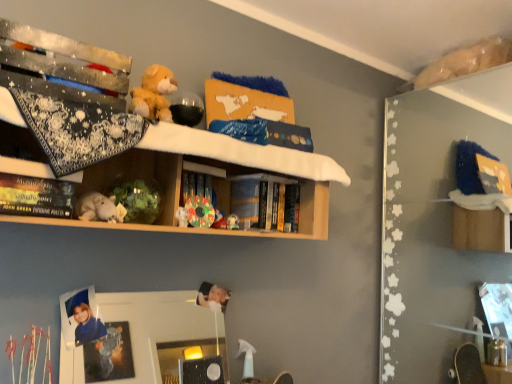
Where is `multicolored plastic toy at center, the third toy when ordered from front to back`? This screenshot has height=384, width=512. multicolored plastic toy at center, the third toy when ordered from front to back is located at coordinates (200, 211).

Locate an element on the screen. clear glass mirror at center is located at coordinates (141, 338).

Image resolution: width=512 pixels, height=384 pixels. Describe the element at coordinates (100, 208) in the screenshot. I see `white plush toy at center, the 1th toy viewed from the left` at that location.

Measure the distance between translucent plastic toy at center, the second toy in the right-to-left sequence, and camera.

A distance of 4.41 feet exists between translucent plastic toy at center, the second toy in the right-to-left sequence, and camera.

Image resolution: width=512 pixels, height=384 pixels. Find the location of `multicolored plastic toy at center, the first toy positioned from the back`. multicolored plastic toy at center, the first toy positioned from the back is located at coordinates (200, 211).

Are clear glass mirror at center and translucent plastic toy at center, acting as the second toy starting from the back, located far from each other?

A: That's not correct — clear glass mirror at center is a little close to translucent plastic toy at center, acting as the second toy starting from the back.

Considering the positions of point (147, 360) and point (186, 209), is point (147, 360) closer or farther from the camera than point (186, 209)?

Point (147, 360) appears to be farther away from the viewer than point (186, 209).

From a real-world perspective, who is located higher, clear glass mirror at center or translucent plastic toy at center, the second toy in the right-to-left sequence?

In real-world perspective, translucent plastic toy at center, the second toy in the right-to-left sequence, is above.

Is translucent plastic toy at center, the 2th toy when ordered from front to back, inside the boundaries of white plush toy at center, the first toy from the front, or outside?

translucent plastic toy at center, the 2th toy when ordered from front to back, is not enclosed by white plush toy at center, the first toy from the front.

Considering the sizes of objects translucent plastic toy at center, acting as the second toy starting from the back, and white plush toy at center, which is the third toy from back to front, in the image provided, who is bigger, translucent plastic toy at center, acting as the second toy starting from the back, or white plush toy at center, which is the third toy from back to front,?

white plush toy at center, which is the third toy from back to front.

Can you confirm if translucent plastic toy at center, which is the 2th toy from left to right, is wider than white plush toy at center, the third toy from the right?

No, translucent plastic toy at center, which is the 2th toy from left to right, is not wider than white plush toy at center, the third toy from the right.

From the image's perspective, is translucent plastic toy at center, the second toy in the right-to-left sequence, located beneath white plush toy at center, which is the third toy from back to front?

Yes.

Does hardcover book at upper left, which ranks as the 1th book in front-to-back order, have a smaller size compared to wooden shelf at upper center?

Answer: Yes, hardcover book at upper left, which ranks as the 1th book in front-to-back order, is smaller than wooden shelf at upper center.

Which is correct: hardcover book at upper left, which ranks as the 1th book in front-to-back order, is inside wooden shelf at upper center, or outside of it?

hardcover book at upper left, which ranks as the 1th book in front-to-back order, can be found inside wooden shelf at upper center.

Is hardcover book at upper left, which ranks as the 1th book in front-to-back order, wider than wooden shelf at upper center?

In fact, hardcover book at upper left, which ranks as the 1th book in front-to-back order, might be narrower than wooden shelf at upper center.

From a real-world perspective, is hardcover book at center, acting as the 1th book starting from the back, on top of multicolored plastic toy at center, the third toy in the left-to-right sequence?

Yes.

Does hardcover book at center, which ranks as the second book in front-to-back order, have a lesser height compared to multicolored plastic toy at center, the third toy in the left-to-right sequence?

No, hardcover book at center, which ranks as the second book in front-to-back order, is not shorter than multicolored plastic toy at center, the third toy in the left-to-right sequence.

Is hardcover book at center, the second book viewed from the left, facing towards multicolored plastic toy at center, the first toy positioned from the back?

No, hardcover book at center, the second book viewed from the left, is not facing towards multicolored plastic toy at center, the first toy positioned from the back.

Looking at the image, does hardcover book at center, the second book viewed from the left, seem bigger or smaller compared to multicolored plastic toy at center, the first toy positioned from the back?

Clearly, hardcover book at center, the second book viewed from the left, is larger in size than multicolored plastic toy at center, the first toy positioned from the back.

Considering the positions of objects translucent plastic toy at center, which is the 2th toy from left to right, and multicolored plastic toy at center, the 1th toy when ordered from right to left, in the image provided, who is more to the right, translucent plastic toy at center, which is the 2th toy from left to right, or multicolored plastic toy at center, the 1th toy when ordered from right to left,?

multicolored plastic toy at center, the 1th toy when ordered from right to left.

Is translucent plastic toy at center, acting as the second toy starting from the back, surrounding multicolored plastic toy at center, the third toy when ordered from front to back?

Actually, multicolored plastic toy at center, the third toy when ordered from front to back, is outside translucent plastic toy at center, acting as the second toy starting from the back.

Is translucent plastic toy at center, acting as the second toy starting from the back, aimed at multicolored plastic toy at center, the third toy when ordered from front to back?

No, translucent plastic toy at center, acting as the second toy starting from the back, is not aimed at multicolored plastic toy at center, the third toy when ordered from front to back.

Is translucent plastic toy at center, the second toy in the right-to-left sequence, bigger or smaller than multicolored plastic toy at center, the third toy when ordered from front to back?

In the image, translucent plastic toy at center, the second toy in the right-to-left sequence, appears to be smaller than multicolored plastic toy at center, the third toy when ordered from front to back.

Find the location of a particular element. The height and width of the screenshot is (384, 512). book to the left of clear glass mirror at center is located at coordinates (36, 196).

Which is more to the right, clear glass mirror at center or hardcover book at upper left, which ranks as the 1th book in front-to-back order?

clear glass mirror at center.

Are hardcover book at center, placed as the 1th book when sorted from right to left, and hardcover book at upper left, the 1th book positioned from the left, making contact?

No, hardcover book at center, placed as the 1th book when sorted from right to left, is not next to hardcover book at upper left, the 1th book positioned from the left.

Between hardcover book at center, the second book viewed from the left, and hardcover book at upper left, which ranks as the 1th book in front-to-back order, which one has larger width?

Wider between the two is hardcover book at upper left, which ranks as the 1th book in front-to-back order.

Would you say hardcover book at center, acting as the 1th book starting from the back, is inside or outside hardcover book at upper left, arranged as the second book when viewed from the right?

hardcover book at center, acting as the 1th book starting from the back, is outside hardcover book at upper left, arranged as the second book when viewed from the right.

From a real-world perspective, starting from the clear glass mirror at center, which toy is the 1st one vertically above it? Please provide its 2D coordinates.

[(182, 217)]

Find the location of a particular element. toy that is on the left side of translucent plastic toy at center, the 2th toy when ordered from front to back is located at coordinates (100, 208).

Based on their spatial positions, is hardcover book at upper left, which ranks as the 1th book in front-to-back order, or white plush toy at center, the third toy from the right, closer to multicolored plastic toy at center, the third toy in the left-to-right sequence?

white plush toy at center, the third toy from the right, is positioned closer to the anchor multicolored plastic toy at center, the third toy in the left-to-right sequence.

Which object lies nearer to the anchor point multicolored plastic toy at center, the third toy when ordered from front to back, translucent plastic toy at center, acting as the second toy starting from the back, or clear glass mirror at center?

The object closer to multicolored plastic toy at center, the third toy when ordered from front to back, is translucent plastic toy at center, acting as the second toy starting from the back.

Looking at the image, which one is located further to translucent plastic toy at center, which is the 2th toy from left to right, multicolored plastic toy at center, the third toy in the left-to-right sequence, or hardcover book at center, placed as the 1th book when sorted from right to left?

Based on the image, hardcover book at center, placed as the 1th book when sorted from right to left, appears to be further to translucent plastic toy at center, which is the 2th toy from left to right.

When comparing their distances from clear glass mirror at center, does translucent plastic toy at center, the second toy in the right-to-left sequence, or hardcover book at upper left, which ranks as the 1th book in front-to-back order, seem closer?

Based on the image, translucent plastic toy at center, the second toy in the right-to-left sequence, appears to be nearer to clear glass mirror at center.

Estimate the real-world distances between objects in this image. Which object is further from wooden shelf at upper center, translucent plastic toy at center, acting as the second toy starting from the back, or clear glass mirror at center?

Among the two, clear glass mirror at center is located further to wooden shelf at upper center.

From the picture: Looking at the image, which one is located further to translucent plastic toy at center, acting as the second toy starting from the back, white plush toy at center, the third toy from the right, or hardcover book at center, which ranks as the second book in front-to-back order?

hardcover book at center, which ranks as the second book in front-to-back order, lies further to translucent plastic toy at center, acting as the second toy starting from the back, than the other object.

From the image, which object appears to be farther from multicolored plastic toy at center, the 1th toy when ordered from right to left, hardcover book at upper left, arranged as the second book when viewed from the right, or clear glass mirror at center?

Among the two, clear glass mirror at center is located further to multicolored plastic toy at center, the 1th toy when ordered from right to left.

When comparing their distances from multicolored plastic toy at center, the 1th toy when ordered from right to left, does wooden shelf at upper center or hardcover book at upper left, which ranks as the 1th book in front-to-back order, seem further?

hardcover book at upper left, which ranks as the 1th book in front-to-back order, is positioned further to the anchor multicolored plastic toy at center, the 1th toy when ordered from right to left.

Where is `toy between hardcover book at upper left, the 2th book when ordered from back to front, and translucent plastic toy at center, the 2th toy when ordered from front to back, from left to right`? The height and width of the screenshot is (384, 512). toy between hardcover book at upper left, the 2th book when ordered from back to front, and translucent plastic toy at center, the 2th toy when ordered from front to back, from left to right is located at coordinates (100, 208).

At what (x,y) coordinates should I click in order to perform the action: click on book positioned between wooden shelf at upper center and translucent plastic toy at center, the 2th toy when ordered from front to back, from near to far. Please return your answer as a coordinate pair (x, y). The image size is (512, 384). Looking at the image, I should click on (36, 196).

Identify the location of toy between white plush toy at center, the first toy from the front, and multicolored plastic toy at center, the third toy when ordered from front to back. (182, 217).

Find the location of a particular element. The height and width of the screenshot is (384, 512). book located between wooden shelf at upper center and multicolored plastic toy at center, the third toy in the left-to-right sequence, in the depth direction is located at coordinates (36, 196).